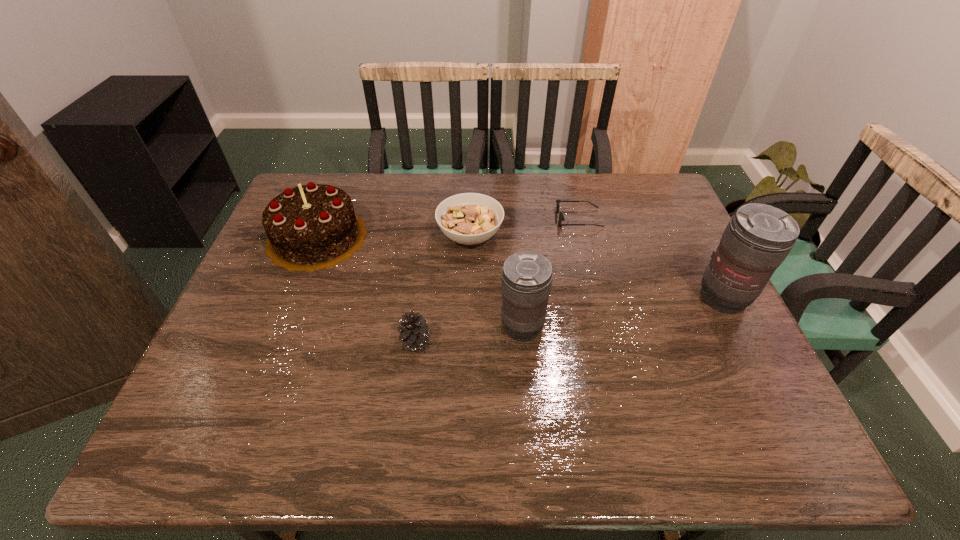
I want to click on free spot between the stew and the fifth object from left to right, so click(525, 227).

You are a GUI agent. You are given a task and a screenshot of the screen. Output one action in this format:
    pyautogui.click(x=<x>, y=<y>)
    Task: Click on the vacant space in between the tallest object and the shorter telephoto lens
    
    Given the screenshot: What is the action you would take?
    pyautogui.click(x=622, y=312)

The image size is (960, 540). What are the coordinates of `vacant space that's between the stew and the leftmost object` in the screenshot? It's located at (394, 237).

I want to click on unoccupied position between the stew and the pinecone, so click(x=443, y=288).

Identify the location of unoccupied position between the pinecone and the tallest object. (569, 319).

Find the location of a particular element. This screenshot has height=540, width=960. free space between the stew and the sunglasses is located at coordinates (525, 227).

Identify the location of free space that is in between the stew and the pinecone. [443, 288].

At what (x,y) coordinates should I click in order to perform the action: click on blank region between the leftmost object and the stew. Please return your answer as a coordinate pair (x, y). This screenshot has height=540, width=960. Looking at the image, I should click on (394, 237).

Where is `vacant region between the stew and the tallest object`? vacant region between the stew and the tallest object is located at coordinates (597, 267).

Select which object is the closest to the shorter telephoto lens. Please provide its 2D coordinates. Your answer should be formatted as a tuple, i.e. [(x, y)], where the tuple contains the x and y coordinates of a point satisfying the conditions above.

[(414, 332)]